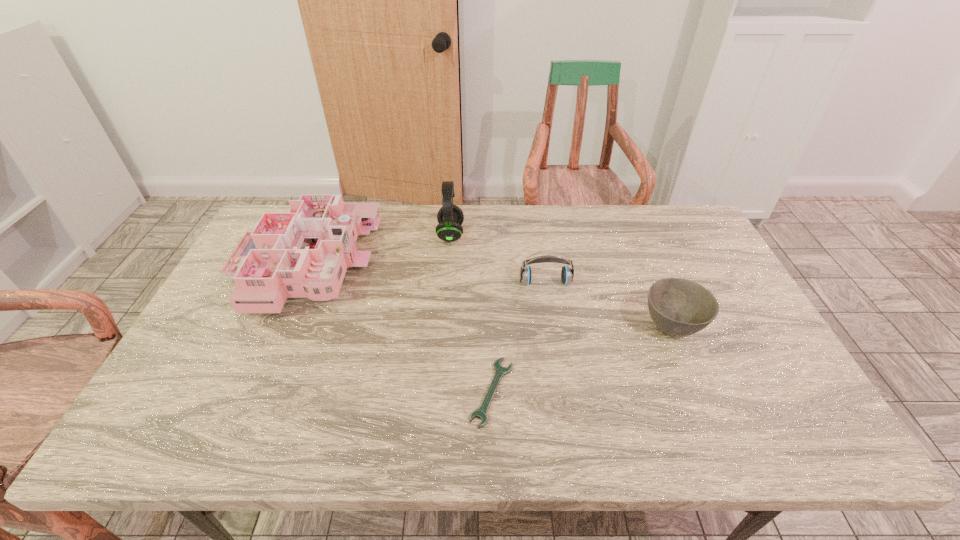
Locate an element on the screen. This screenshot has width=960, height=540. the left headset is located at coordinates (450, 217).

You are a GUI agent. You are given a task and a screenshot of the screen. Output one action in this format:
    pyautogui.click(x=<x>, y=<y>)
    Task: Click on the tallest object
    Image resolution: width=960 pixels, height=540 pixels.
    Given the screenshot: What is the action you would take?
    pyautogui.click(x=450, y=217)

The width and height of the screenshot is (960, 540). What are the coordinates of `the leftmost object` in the screenshot? It's located at (305, 253).

The image size is (960, 540). In order to click on the right headset in this screenshot , I will do `click(567, 274)`.

The image size is (960, 540). Identify the location of the nearer headset. (567, 274).

Identify the location of bowl. The height and width of the screenshot is (540, 960). (680, 307).

At what (x,y) coordinates should I click in order to perform the action: click on wrench. Please return your answer as a coordinate pair (x, y). Looking at the image, I should click on (500, 371).

You are a GUI agent. You are given a task and a screenshot of the screen. Output one action in this format:
    pyautogui.click(x=<x>, y=<y>)
    Task: Click on the shortest object
    The image size is (960, 540).
    Given the screenshot: What is the action you would take?
    pyautogui.click(x=500, y=371)

Find the location of a particular element. free region located on the ear cups of the left headset is located at coordinates (559, 234).

The width and height of the screenshot is (960, 540). In order to click on vacant space located at the front entrance of the leftmost object in this screenshot , I will do `click(390, 264)`.